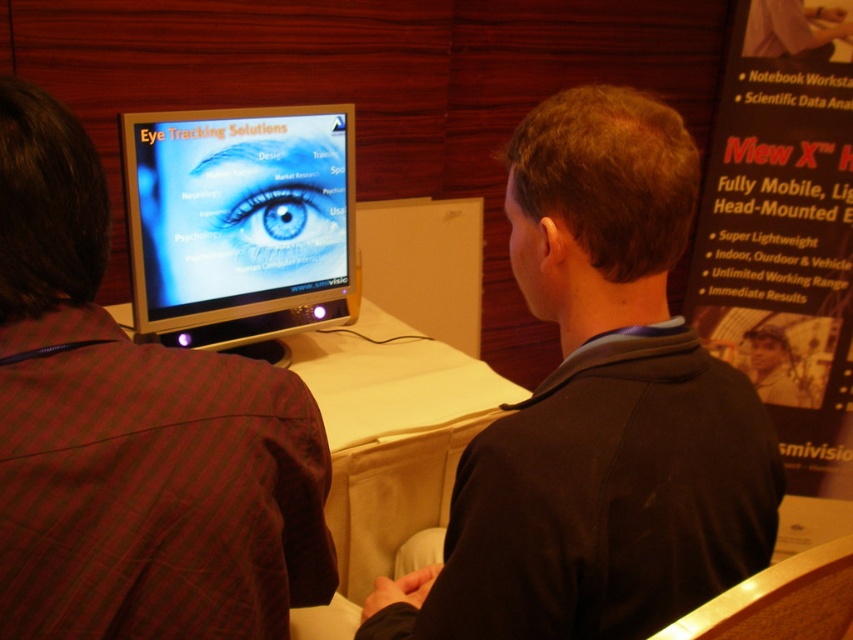
Question: Can you confirm if matte black poster at upper right is positioned to the left of white fabric table at center?

Choices:
 (A) yes
 (B) no

Answer: (B)

Question: Is white fabric table at center smaller than blue glossy eye at center?

Choices:
 (A) no
 (B) yes

Answer: (A)

Question: Can you confirm if satin black monitor at center is smaller than white fabric table at center?

Choices:
 (A) yes
 (B) no

Answer: (A)

Question: Which point appears farthest from the camera in this image?

Choices:
 (A) (757, 72)
 (B) (218, 452)

Answer: (A)

Question: Considering the real-world distances, which object is closest to the matte black poster at upper right?

Choices:
 (A) white fabric table at center
 (B) black matte jacket at center

Answer: (A)

Question: Considering the real-world distances, which object is closest to the matte black poster at upper right?

Choices:
 (A) satin black monitor at center
 (B) black matte jacket at center
 (C) plaid fabric jacket at left

Answer: (A)